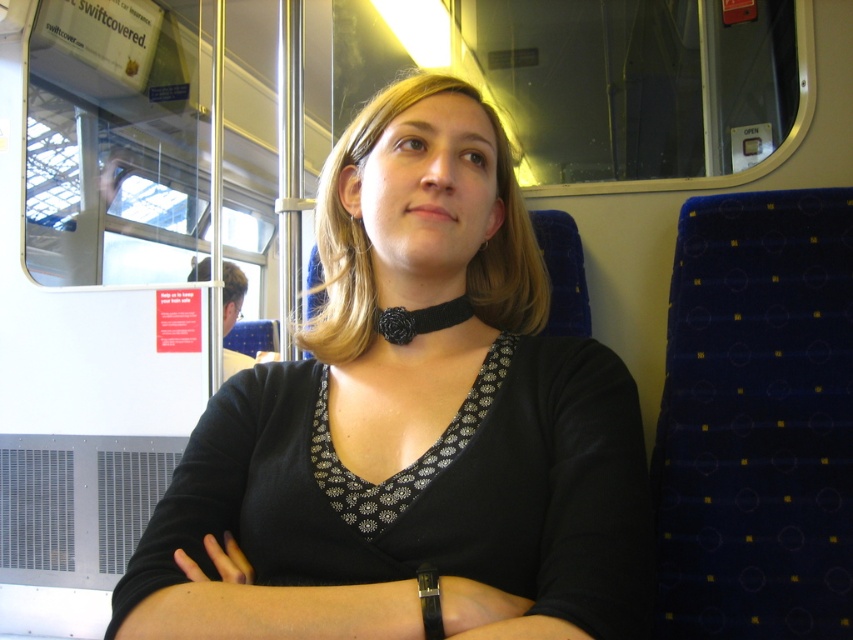
Question: Can you confirm if black matte choker at center is positioned to the left of black fabric neckband at center?

Choices:
 (A) yes
 (B) no

Answer: (A)

Question: Which point appears closest to the camera in this image?

Choices:
 (A) (462, 225)
 (B) (431, 308)

Answer: (A)

Question: Can you confirm if black matte choker at center is positioned above black fabric neckband at center?

Choices:
 (A) yes
 (B) no

Answer: (B)

Question: Which of the following is the farthest from the observer?

Choices:
 (A) (521, 330)
 (B) (399, 317)

Answer: (A)

Question: From the image, what is the correct spatial relationship of black matte choker at center in relation to black fabric neckband at center?

Choices:
 (A) right
 (B) left

Answer: (B)